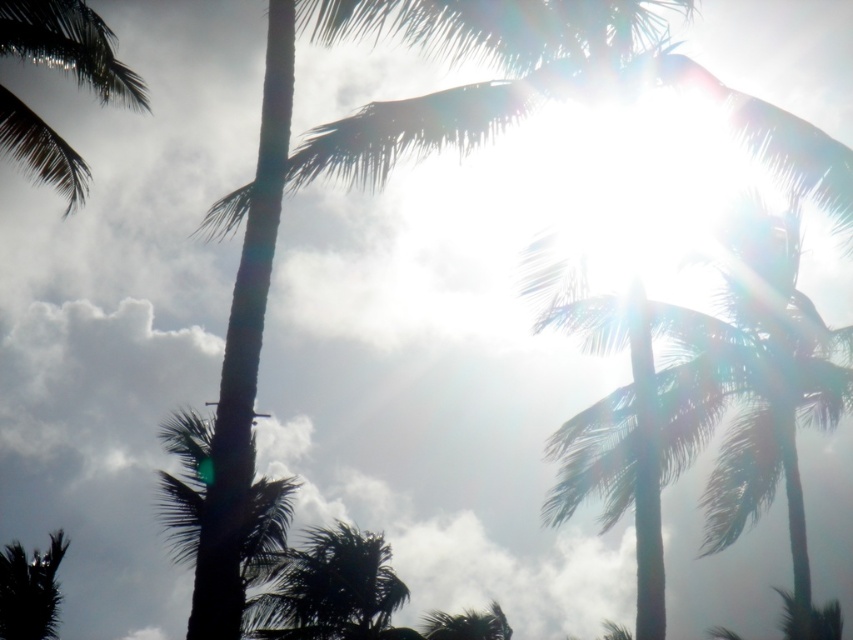
Question: Which object appears farthest from the camera in this image?

Choices:
 (A) green leafy palm tree at upper left
 (B) green leafy palm tree at lower center

Answer: (B)

Question: Which object is positioned farthest from the green leafy palm tree at upper left?

Choices:
 (A) green leafy palm tree at lower center
 (B) silhouette leafy palm at bottom left
 (C) green leafy coconut tree at upper center

Answer: (C)

Question: Does green leafy palm tree at upper left lie in front of silhouette leafy palm at bottom left?

Choices:
 (A) yes
 (B) no

Answer: (A)

Question: Which point is closer to the camera?

Choices:
 (A) green leafy palm tree at center
 (B) green leafy coconut tree at upper center
 (C) green leafy palm tree at upper left

Answer: (A)

Question: Does green leafy palm tree at upper left appear under green leafy palm tree at lower center?

Choices:
 (A) yes
 (B) no

Answer: (B)

Question: In this image, where is green leafy coconut tree at upper center located relative to green leafy palm tree at upper left?

Choices:
 (A) below
 (B) above

Answer: (A)